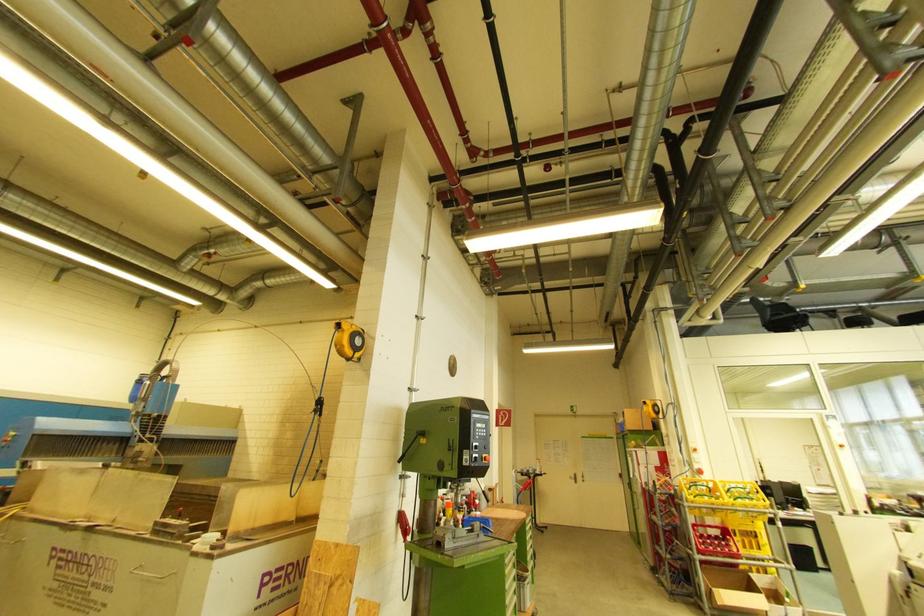
You are a GUI agent. You are given a task and a screenshot of the screen. Output one action in this format:
    pyautogui.click(x=<x>, y=<y>)
    Task: Click on the red stop button
    Image resolution: width=924 pixels, height=616 pixels.
    Given the screenshot: What is the action you would take?
    pyautogui.click(x=481, y=459)